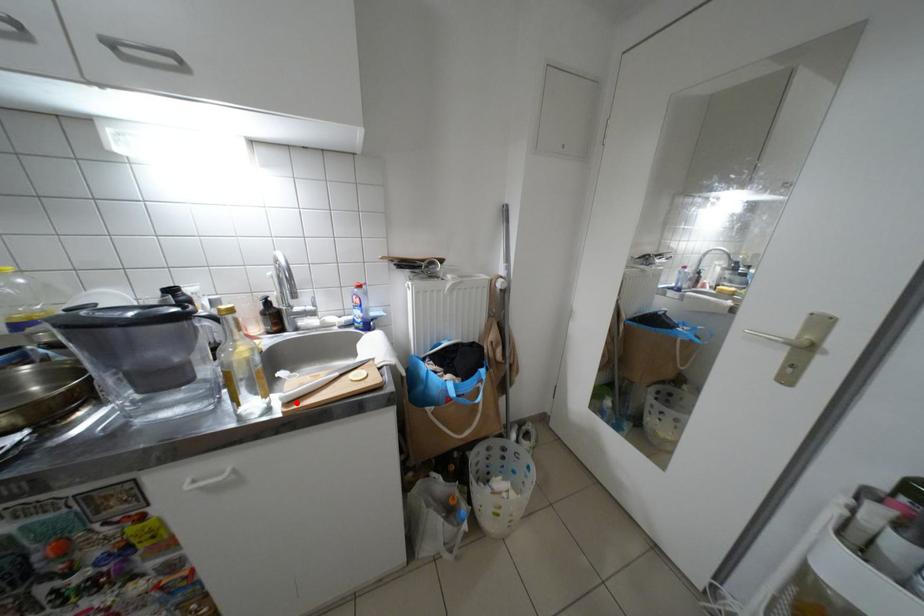
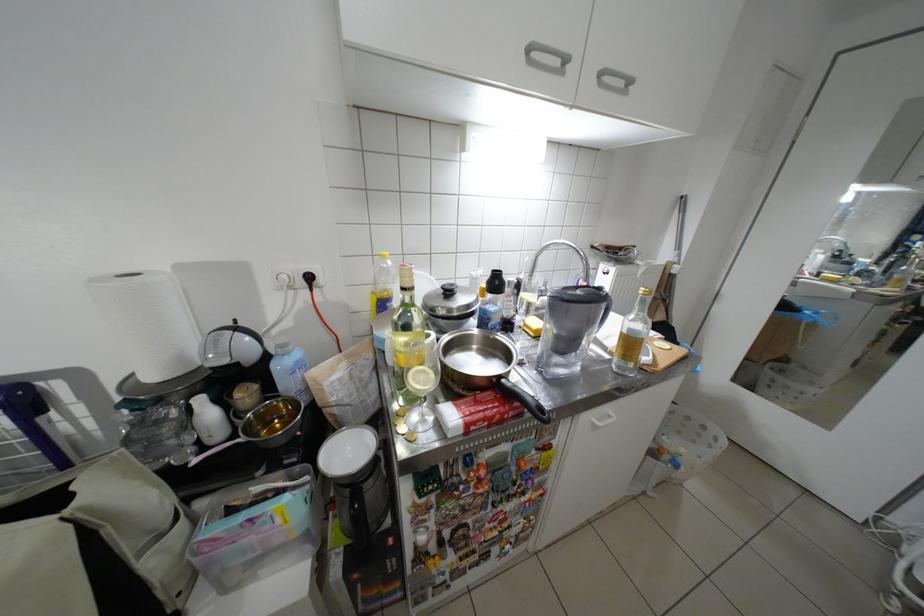
In the second image, find the point that corresponds to the highlighted location in the first image.

(662, 363)